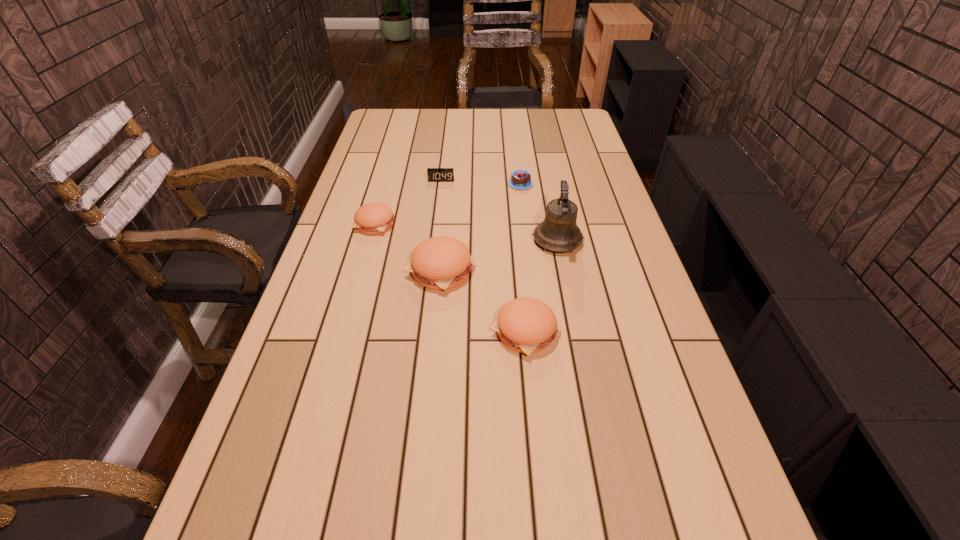
This screenshot has width=960, height=540. In order to click on blank region between the bell and the chocolate cake in this screenshot , I will do `click(539, 212)`.

Identify which object is the second closest to the second nearest patty. Please provide its 2D coordinates. Your answer should be formatted as a tuple, i.e. [(x, y)], where the tuple contains the x and y coordinates of a point satisfying the conditions above.

[(373, 218)]

At what (x,y) coordinates should I click in order to perform the action: click on the closest object relative to the leftmost object. Please return your answer as a coordinate pair (x, y). This screenshot has width=960, height=540. Looking at the image, I should click on (439, 263).

Locate an element on the screen. This screenshot has height=540, width=960. patty object that ranks as the closest to the third tallest object is located at coordinates (439, 263).

Find the location of `patty that stands as the second closest to the leftmost patty`. patty that stands as the second closest to the leftmost patty is located at coordinates (526, 325).

The height and width of the screenshot is (540, 960). I want to click on free space that satisfies the following two spatial constraints: 1. on the front-facing side of the alarm clock; 2. on the left side of the nearest object, so click(x=423, y=332).

At what (x,y) coordinates should I click in order to perform the action: click on vacant space that satisfies the following two spatial constraints: 1. on the front-facing side of the second shortest patty; 2. on the right side of the alarm clock. Please return your answer as a coordinate pair (x, y). This screenshot has height=540, width=960. Looking at the image, I should click on (423, 332).

In order to click on free space that satisfies the following two spatial constraints: 1. on the front-facing side of the second patty from right to left; 2. on the left side of the alarm clock in this screenshot , I will do `click(430, 271)`.

Where is `free space in the image that satisfies the following two spatial constraints: 1. on the front-facing side of the chocolate cake; 2. on the right side of the alarm clock`? The height and width of the screenshot is (540, 960). free space in the image that satisfies the following two spatial constraints: 1. on the front-facing side of the chocolate cake; 2. on the right side of the alarm clock is located at coordinates (441, 184).

You are a GUI agent. You are given a task and a screenshot of the screen. Output one action in this format:
    pyautogui.click(x=<x>, y=<y>)
    Task: Click on the free space that satisfies the following two spatial constraints: 1. on the front-facing side of the nearest patty; 2. on the left side of the alarm clock
    The image size is (960, 540).
    Given the screenshot: What is the action you would take?
    pyautogui.click(x=423, y=332)